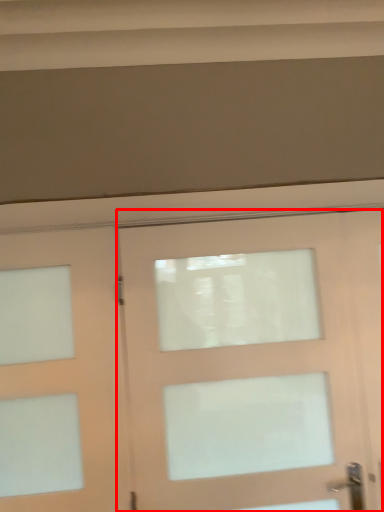
Question: Considering the relative positions of door (annotated by the red box) and door in the image provided, where is door (annotated by the red box) located with respect to the staircase?

Choices:
 (A) left
 (B) right

Answer: (B)